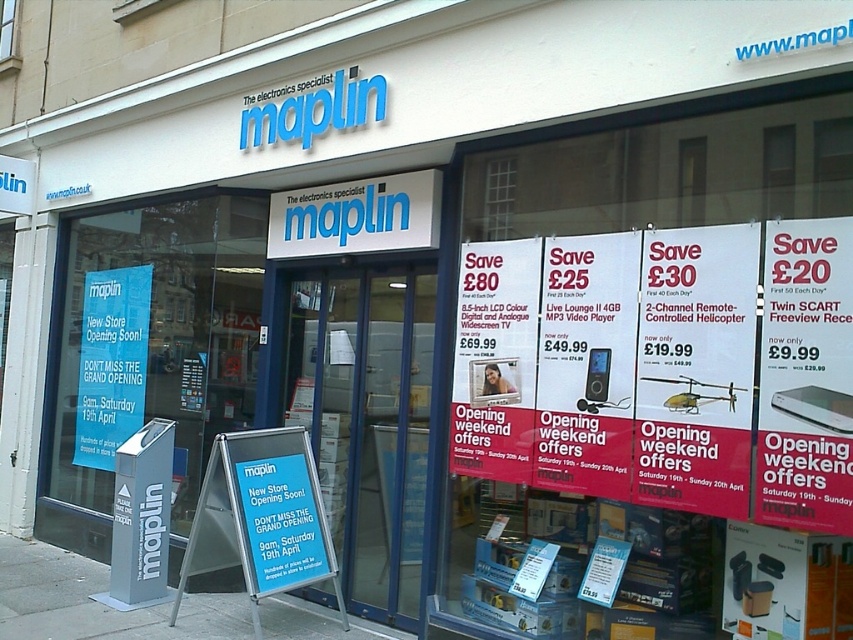
Question: Is blue glass door at center closer to the viewer compared to blue plastic sign at center?

Choices:
 (A) no
 (B) yes

Answer: (A)

Question: Which point is farther to the camera?

Choices:
 (A) blue paper sign at left
 (B) transparent glass window at upper left

Answer: (B)

Question: Which point appears closest to the camera in this image?

Choices:
 (A) (738, 358)
 (B) (107, 420)
 (C) (491, 388)

Answer: (A)

Question: Can you confirm if blue glass door at center is bigger than blue paper sign at left?

Choices:
 (A) no
 (B) yes

Answer: (B)

Question: Which object is positioned closest to the transparent glass window at upper left?

Choices:
 (A) matte black video player at center
 (B) blue glass door at center

Answer: (B)

Question: From the image, what is the correct spatial relationship of blue paper at left in relation to transparent glass window at upper left?

Choices:
 (A) right
 (B) left

Answer: (A)